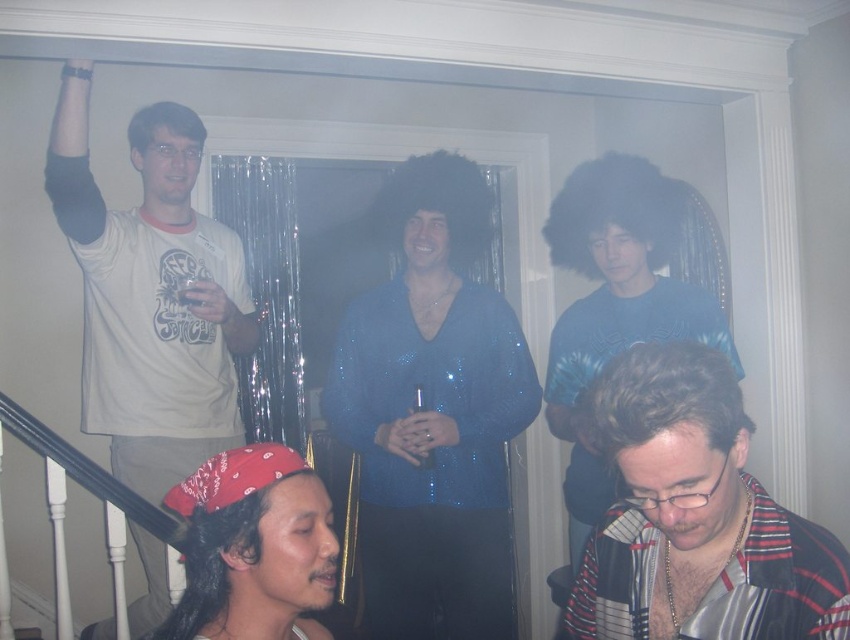
Question: In this image, where is sparkly blue shirt at center located relative to blue sequined shirt at center?

Choices:
 (A) right
 (B) left

Answer: (B)

Question: Which object is farther from the camera taking this photo?

Choices:
 (A) white matte t-shirt at upper left
 (B) striped fabric shirt at lower right

Answer: (A)

Question: Which point is farther to the camera?

Choices:
 (A) white matte t-shirt at upper left
 (B) striped fabric shirt at lower right

Answer: (A)

Question: Does white matte t-shirt at upper left appear on the left side of blue sequined shirt at center?

Choices:
 (A) no
 (B) yes

Answer: (B)

Question: Does sparkly blue shirt at center have a larger size compared to white matte t-shirt at upper left?

Choices:
 (A) no
 (B) yes

Answer: (A)

Question: Among these objects, which one is farthest from the camera?

Choices:
 (A) white matte t-shirt at upper left
 (B) sparkly blue shirt at center
 (C) striped fabric shirt at lower right

Answer: (B)